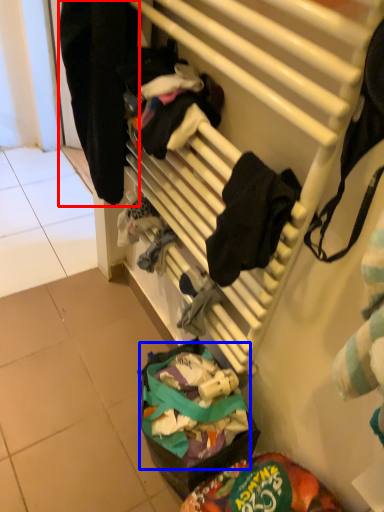
Question: Which object is closer to the camera taking this photo, clothing (highlighted by a red box) or food (highlighted by a blue box)?

Choices:
 (A) clothing
 (B) food

Answer: (A)